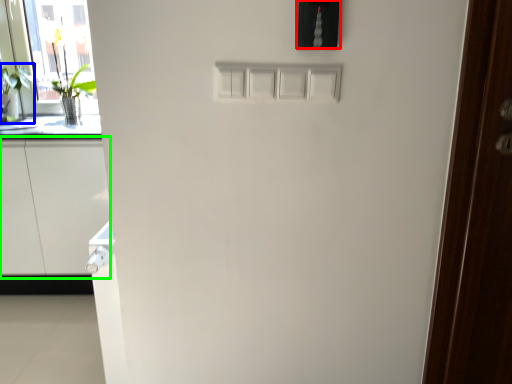
Question: Based on their relative distances, which object is nearer to light switch (highlighted by a red box)? Choose from plant (highlighted by a blue box) and cabinetry (highlighted by a green box).

Choices:
 (A) plant
 (B) cabinetry

Answer: (B)